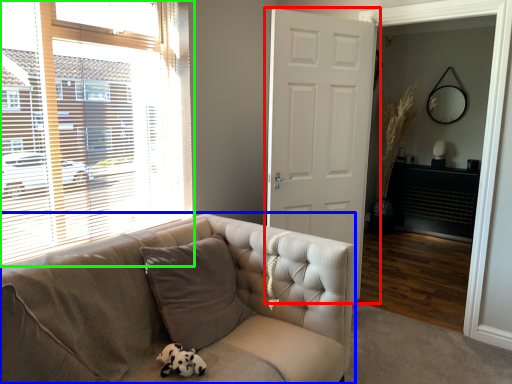
Question: Based on their relative distances, which object is nearer to door (highlighted by a red box)? Choose from studio couch (highlighted by a blue box) and window (highlighted by a green box).

Choices:
 (A) studio couch
 (B) window

Answer: (B)